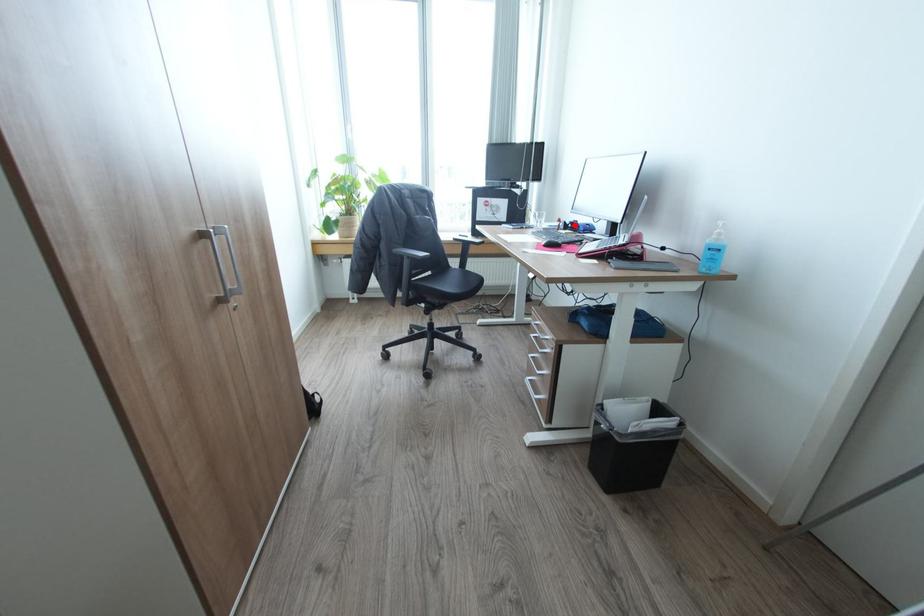
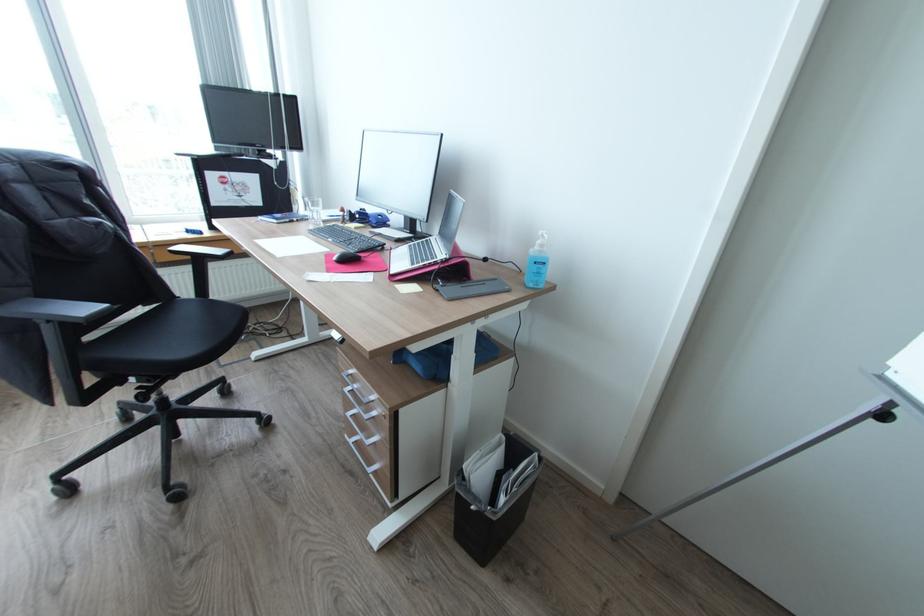
In the second image, find the point that corresponds to the highlighted location in the first image.

(362, 216)